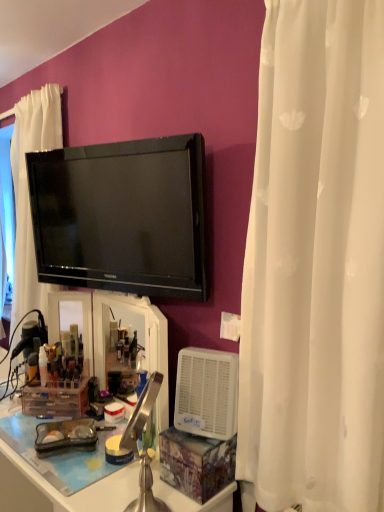
Locate an element on the screen. The width and height of the screenshot is (384, 512). blank space situated above white plastic air purifier at lower right (from a real-world perspective) is located at coordinates (205, 351).